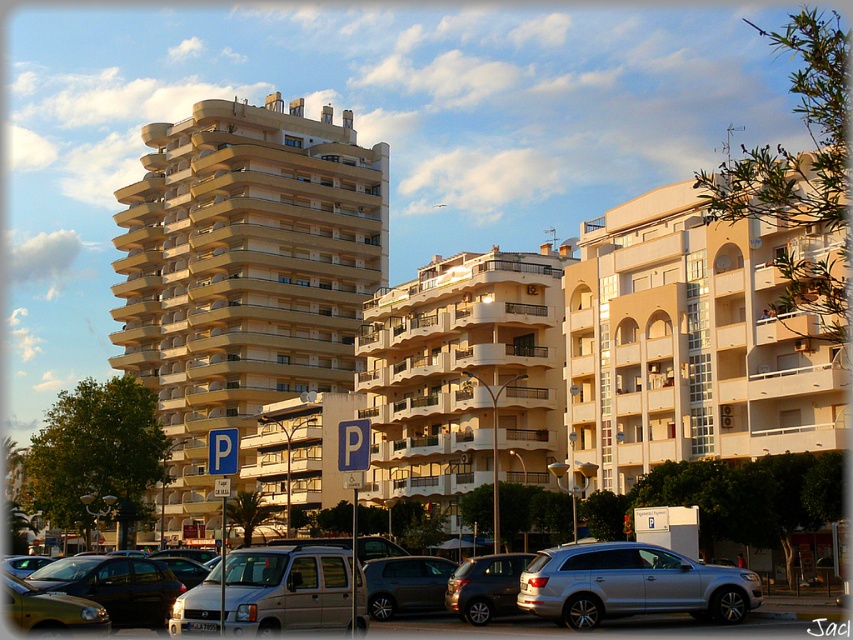
Question: Can you confirm if beige concrete building at center is positioned to the right of metallic silver van at center?

Choices:
 (A) no
 (B) yes

Answer: (A)

Question: Which point is farther to the camera?

Choices:
 (A) (178, 605)
 (B) (672, 605)

Answer: (B)

Question: Which of the following is the farthest from the observer?

Choices:
 (A) (328, 556)
 (B) (686, 604)
 (C) (286, 628)
 (D) (399, 556)

Answer: (D)

Question: Which point is farther to the camera?

Choices:
 (A) beige concrete building at center
 (B) metallic silver van at center

Answer: (A)

Question: Observing the image, what is the correct spatial positioning of beige concrete building at center in reference to metallic silver van at center?

Choices:
 (A) below
 (B) above

Answer: (B)

Question: Is metallic silver van at center wider than dark gray metallic suv at center?

Choices:
 (A) yes
 (B) no

Answer: (A)